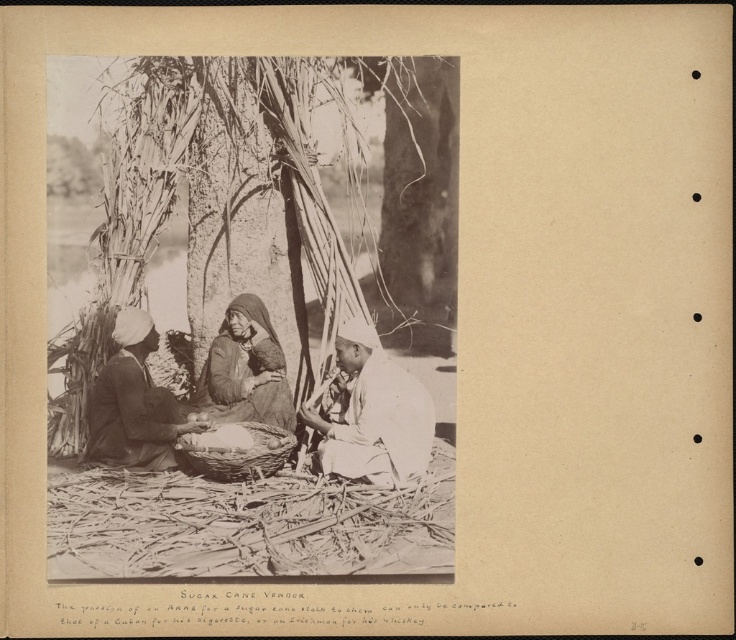
You are a photographer adjusting your camera to focus on two points in the scene. The first point is at coordinates point (342, 339) and the second is at point (160, 464). Which point should you focus on first if you want to capture both points clearly in your photo?

You should focus on point (342, 339) first because it is closer to the camera than point (160, 464). This ensures that both points will be in focus when using a proper depth of field.

You are a tailor measuring fabrics in the scene. You have a 40 inch long tape measure. Can you determine if the distance between the dark brown fabric turban at lower left and the dark brown fabric at center is within your tape measure range?

The distance between the dark brown fabric turban at lower left and the dark brown fabric at center is 38.62 inches, which is within the 40 inch tape measure range.